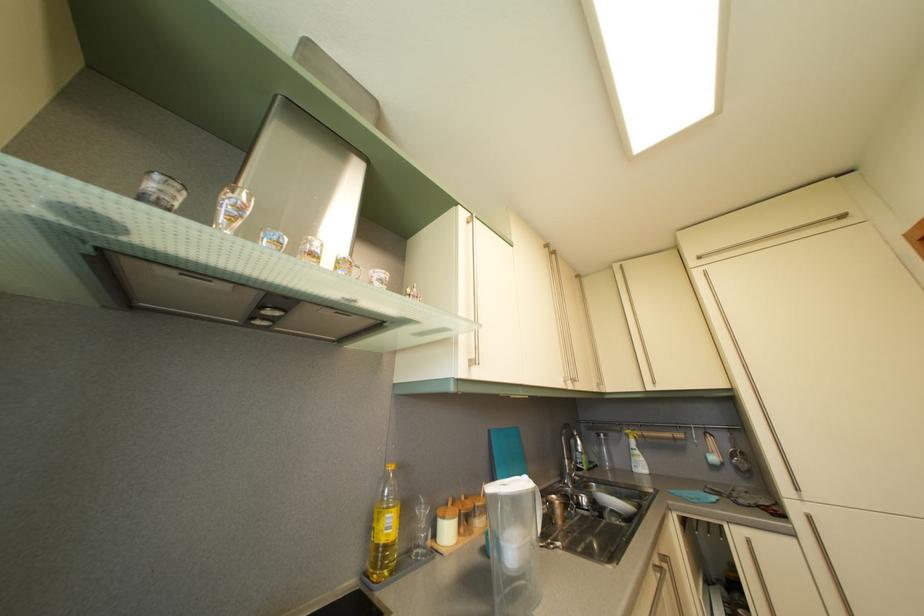
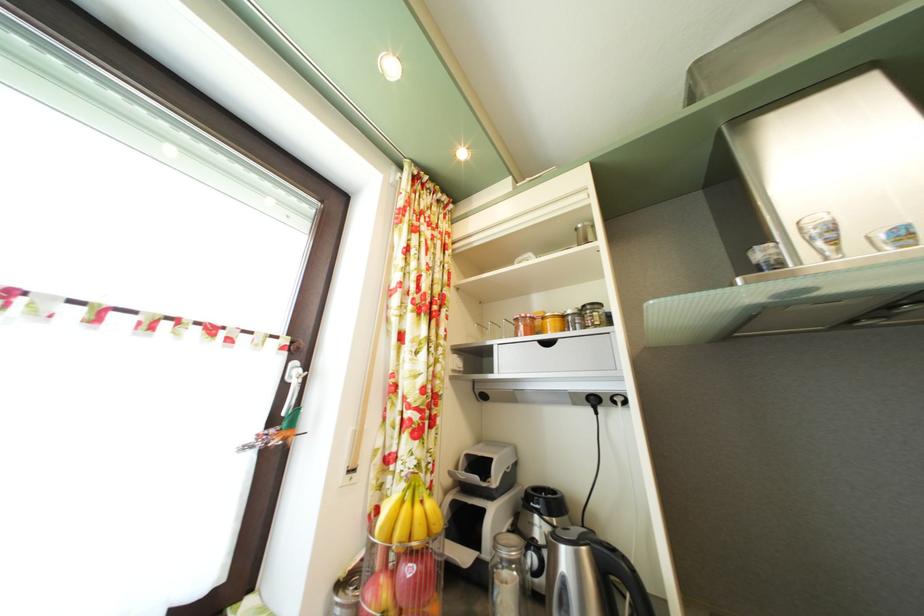
Locate, in the second image, the point that corresponds to (x=186, y=193) in the first image.

(781, 252)